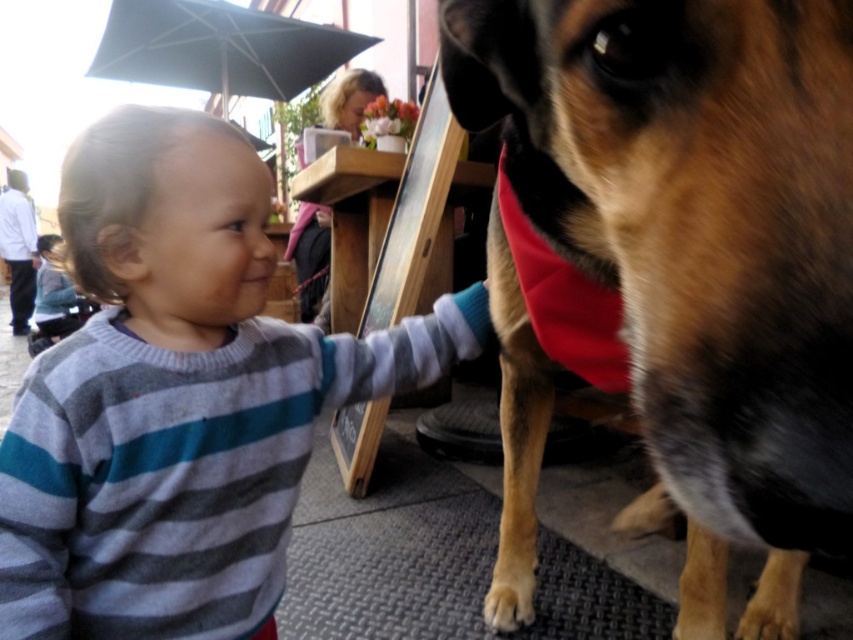
Who is positioned more to the left, striped sweater at center or blonde hair at upper center?

blonde hair at upper center is more to the left.

Find the location of a particular element. This screenshot has width=853, height=640. striped sweater at center is located at coordinates (178, 396).

Does point (158, 572) come behind point (325, 100)?

No, (158, 572) is closer to viewer.

The width and height of the screenshot is (853, 640). Find the location of `striped sweater at center`. striped sweater at center is located at coordinates (178, 396).

Does brown fur dog at center have a smaller size compared to striped sweater at center?

Incorrect, brown fur dog at center is not smaller in size than striped sweater at center.

Measure the distance between point (550, 348) and camera.

They are 39.10 inches apart.

Locate an element on the screen. brown fur dog at center is located at coordinates (674, 268).

Can you confirm if striped sweater at center is taller than striped sweater at left?

Incorrect, striped sweater at center's height is not larger of striped sweater at left's.

Does striped sweater at center appear over striped sweater at left?

No.

Is point (184, 545) closer to camera compared to point (36, 301)?

Yes, point (184, 545) is closer to viewer.

Where is `striped sweater at center`? striped sweater at center is located at coordinates (178, 396).